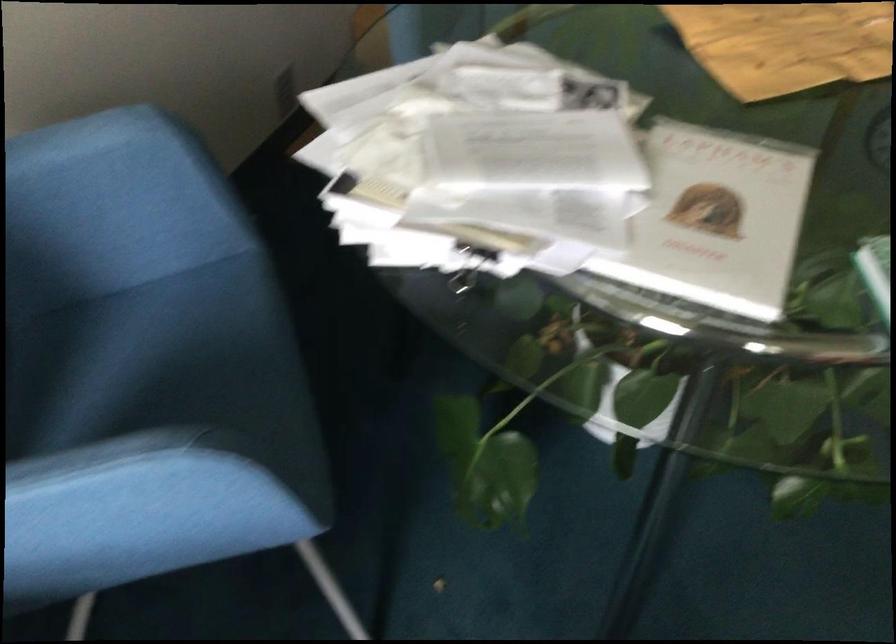
What do you see at coordinates (158, 357) in the screenshot?
I see `the blue chair sitting surface` at bounding box center [158, 357].